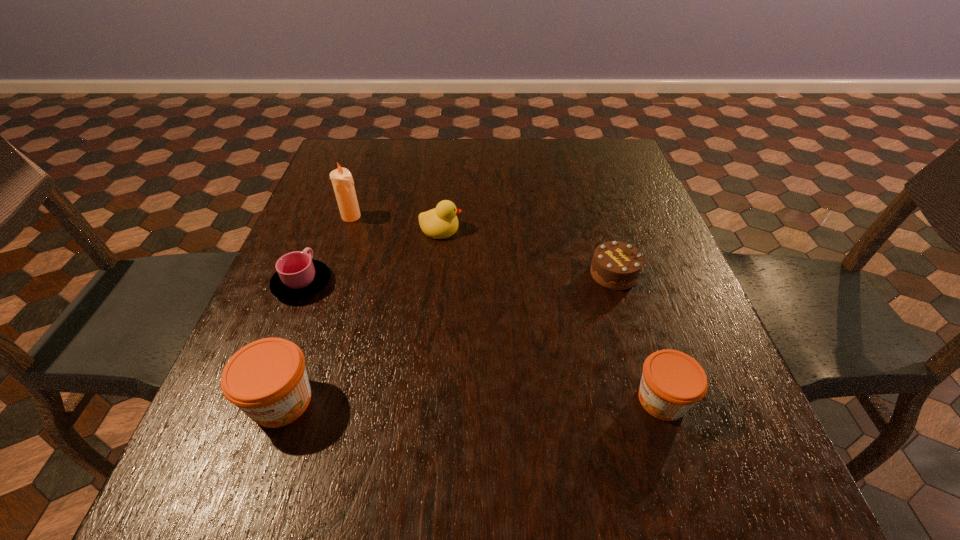
Image resolution: width=960 pixels, height=540 pixels. Identify the location of unoccupied position between the shorter jam and the duckling. (552, 314).

In order to click on vacant point located between the cup and the third object from right to left in this screenshot , I will do `click(372, 256)`.

Find the location of a particular element. This screenshot has width=960, height=540. free space between the left jam and the shorter jam is located at coordinates (471, 400).

The width and height of the screenshot is (960, 540). I want to click on empty space between the taller jam and the shorter jam, so click(x=471, y=400).

You are a GUI agent. You are given a task and a screenshot of the screen. Output one action in this format:
    pyautogui.click(x=<x>, y=<y>)
    Task: Click on the free space that is in between the fourth object from left to right and the tallest object
    The image size is (960, 540).
    Given the screenshot: What is the action you would take?
    pyautogui.click(x=396, y=222)

This screenshot has height=540, width=960. What are the coordinates of `empty space between the chocolate cake and the candle` in the screenshot? It's located at (483, 245).

Where is `free space between the right jam and the cup`? This screenshot has width=960, height=540. free space between the right jam and the cup is located at coordinates (482, 342).

Find the location of `empty space between the chocolate cake and the right jam`. empty space between the chocolate cake and the right jam is located at coordinates (637, 336).

This screenshot has height=540, width=960. I want to click on vacant space that is in between the candle and the chocolate cake, so click(x=483, y=245).

Image resolution: width=960 pixels, height=540 pixels. I want to click on the closest object to the chocolate cake, so click(x=672, y=382).